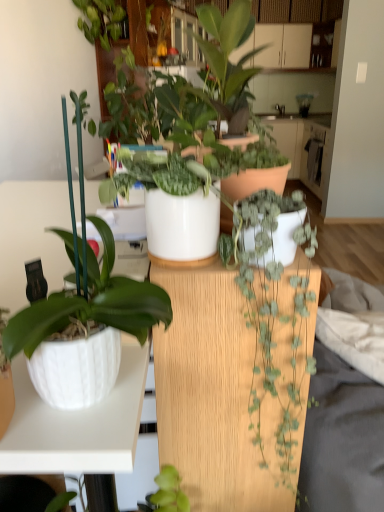
How much space does white glossy pot at left, the third houseplant when ordered from top to bottom, occupy vertically?

The height of white glossy pot at left, the third houseplant when ordered from top to bottom, is 45.43 centimeters.

What do you see at coordinates (301, 117) in the screenshot? The height and width of the screenshot is (512, 384). I see `white glossy countertop at center` at bounding box center [301, 117].

Measure the distance between point (x=316, y=119) and camera.

The depth of point (x=316, y=119) is 16.52 feet.

This screenshot has height=512, width=384. Find the location of `white glossy pot at left, the third houseplant when ordered from top to bottom`. white glossy pot at left, the third houseplant when ordered from top to bottom is located at coordinates (83, 313).

How different are the orientations of white glossy pot at center, the 2th houseplant when ordered from top to bottom, and matte white pot at center, acting as the 1th houseplant starting from the top, in degrees?

The facing directions of white glossy pot at center, the 2th houseplant when ordered from top to bottom, and matte white pot at center, acting as the 1th houseplant starting from the top, are 0.000222 degrees apart.

Looking at this image, is white glossy pot at center, the 2th houseplant when ordered from top to bottom, in front of or behind matte white pot at center, which appears as the fourth houseplant when ordered from the bottom, in the image?

Visually, white glossy pot at center, the 2th houseplant when ordered from top to bottom, is located in front of matte white pot at center, which appears as the fourth houseplant when ordered from the bottom.

Consider the image. From a real-world perspective, does white glossy pot at center, the 2th houseplant when ordered from top to bottom, sit lower than matte white pot at center, acting as the 1th houseplant starting from the top?

Yes, from a real-world perspective, white glossy pot at center, the 2th houseplant when ordered from top to bottom, is beneath matte white pot at center, acting as the 1th houseplant starting from the top.

From the picture: Is white glossy pot at center, placed as the third houseplant when sorted from bottom to top, far away from matte white pot at center, acting as the 1th houseplant starting from the top?

white glossy pot at center, placed as the third houseplant when sorted from bottom to top, is near matte white pot at center, acting as the 1th houseplant starting from the top, not far away.

Looking at their sizes, would you say white glossy pot at center, the 2th houseplant when ordered from top to bottom, is wider or thinner than white glossy pot at left, the second houseplant in the bottom-to-top sequence?

Clearly, white glossy pot at center, the 2th houseplant when ordered from top to bottom, has less width compared to white glossy pot at left, the second houseplant in the bottom-to-top sequence.

Considering the positions of objects white glossy pot at center, placed as the third houseplant when sorted from bottom to top, and white glossy pot at left, the second houseplant in the bottom-to-top sequence, in the image provided, who is more to the left, white glossy pot at center, placed as the third houseplant when sorted from bottom to top, or white glossy pot at left, the second houseplant in the bottom-to-top sequence,?

Positioned to the left is white glossy pot at left, the second houseplant in the bottom-to-top sequence.

Is white glossy pot at center, the 2th houseplant when ordered from top to bottom, not within white glossy pot at left, the second houseplant in the bottom-to-top sequence?

Yes.

Based on the photo, how many degrees apart are the facing directions of white glossy pot at center, the 2th houseplant when ordered from top to bottom, and white glossy pot at left, the third houseplant when ordered from top to bottom?

0.000158 degrees.

From a real-world perspective, is white glossy pot at left, the third houseplant when ordered from top to bottom, positioned over matte white pot at center, which appears as the fourth houseplant when ordered from the bottom, based on gravity?

No, from a real-world perspective, white glossy pot at left, the third houseplant when ordered from top to bottom, is not over matte white pot at center, which appears as the fourth houseplant when ordered from the bottom

Considering the sizes of objects white glossy pot at left, the third houseplant when ordered from top to bottom, and matte white pot at center, which appears as the fourth houseplant when ordered from the bottom, in the image provided, who is wider, white glossy pot at left, the third houseplant when ordered from top to bottom, or matte white pot at center, which appears as the fourth houseplant when ordered from the bottom,?

Wider between the two is matte white pot at center, which appears as the fourth houseplant when ordered from the bottom.

Between white glossy pot at left, the second houseplant in the bottom-to-top sequence, and matte white pot at center, which appears as the fourth houseplant when ordered from the bottom, which one has less height?

Standing shorter between the two is matte white pot at center, which appears as the fourth houseplant when ordered from the bottom.

Is white glossy pot at left, the second houseplant in the bottom-to-top sequence, positioned behind matte white pot at center, acting as the 1th houseplant starting from the top?

No, it is not.

Is white glossy countertop at center at the back of matte white pot at center, acting as the 1th houseplant starting from the top?

No, matte white pot at center, acting as the 1th houseplant starting from the top, is not facing the opposite direction of white glossy countertop at center.

From the image's perspective, which one is positioned lower, matte white pot at center, acting as the 1th houseplant starting from the top, or white glossy countertop at center?

matte white pot at center, acting as the 1th houseplant starting from the top, appears lower in the image.

From a real-world perspective, starting from the white glossy countertop at center, which houseplant is the 3rd one vertically above it? Please provide its 2D coordinates.

[(227, 63)]

Which object is positioned more to the left, white glossy pot at left, the third houseplant when ordered from top to bottom, or white glossy pot at center, placed as the third houseplant when sorted from bottom to top?

white glossy pot at left, the third houseplant when ordered from top to bottom, is more to the left.

Does point (73, 264) come in front of point (207, 106)?

Yes.

In the scene shown: Relative to white glossy pot at center, the 2th houseplant when ordered from top to bottom, is white glossy pot at left, the second houseplant in the bottom-to-top sequence, in front or behind?

In the image, white glossy pot at left, the second houseplant in the bottom-to-top sequence, appears in front of white glossy pot at center, the 2th houseplant when ordered from top to bottom.

Is white glossy pot at left, the second houseplant in the bottom-to-top sequence, oriented away from white glossy pot at center, placed as the third houseplant when sorted from bottom to top?

white glossy pot at left, the second houseplant in the bottom-to-top sequence, is not turned away from white glossy pot at center, placed as the third houseplant when sorted from bottom to top.

Can you see matte white pot at center, which appears as the fourth houseplant when ordered from the bottom, touching white glossy pot at left, the third houseplant when ordered from top to bottom?

No.

Looking at this image, how different are the orientations of matte white pot at center, which appears as the fourth houseplant when ordered from the bottom, and white glossy pot at left, the second houseplant in the bottom-to-top sequence, in degrees?

A: 6.52e-05 degrees separate the facing orientations of matte white pot at center, which appears as the fourth houseplant when ordered from the bottom, and white glossy pot at left, the second houseplant in the bottom-to-top sequence.

Which of these two, matte white pot at center, acting as the 1th houseplant starting from the top, or white glossy pot at left, the second houseplant in the bottom-to-top sequence, is bigger?

white glossy pot at left, the second houseplant in the bottom-to-top sequence, is bigger.

Which object is closer to the camera taking this photo, matte white pot at center, which appears as the fourth houseplant when ordered from the bottom, or white glossy pot at left, the third houseplant when ordered from top to bottom?

white glossy pot at left, the third houseplant when ordered from top to bottom, is in front.

Considering the relative positions of white glossy countertop at center and white glossy pot at center, the 2th houseplant when ordered from top to bottom, in the image provided, is white glossy countertop at center behind white glossy pot at center, the 2th houseplant when ordered from top to bottom,?

Yes, it is behind white glossy pot at center, the 2th houseplant when ordered from top to bottom.

From the image's perspective, is white glossy countertop at center below white glossy pot at center, placed as the third houseplant when sorted from bottom to top?

Actually, white glossy countertop at center appears above white glossy pot at center, placed as the third houseplant when sorted from bottom to top, in the image.

Between white glossy countertop at center and white glossy pot at center, placed as the third houseplant when sorted from bottom to top, which one has larger size?

With larger size is white glossy countertop at center.

Considering the relative positions of white glossy countertop at center and white glossy pot at center, the 2th houseplant when ordered from top to bottom, in the image provided, is white glossy countertop at center to the left or to the right of white glossy pot at center, the 2th houseplant when ordered from top to bottom,?

white glossy countertop at center is to the right of white glossy pot at center, the 2th houseplant when ordered from top to bottom.

Locate an element on the screen. houseplant above the white glossy pot at center, the 2th houseplant when ordered from top to bottom (from the image's perspective) is located at coordinates (227, 63).

From a real-world perspective, which houseplant is the 1st one underneath the white glossy pot at center, the 2th houseplant when ordered from top to bottom? Please provide its 2D coordinates.

[(83, 313)]

From the picture: From the image, which object appears to be farther from green matte plant at center, the fourth houseplant from the top, white glossy countertop at center or white glossy pot at center, placed as the third houseplant when sorted from bottom to top?

The object further to green matte plant at center, the fourth houseplant from the top, is white glossy countertop at center.

Considering their positions, is matte white pot at center, acting as the 1th houseplant starting from the top, positioned closer to white glossy countertop at center than green matte plant at center, the fourth houseplant from the top?

The object closer to white glossy countertop at center is matte white pot at center, acting as the 1th houseplant starting from the top.

When comparing their distances from white glossy pot at left, the third houseplant when ordered from top to bottom, does white glossy pot at center, the 2th houseplant when ordered from top to bottom, or matte white pot at center, which appears as the fourth houseplant when ordered from the bottom, seem further?

matte white pot at center, which appears as the fourth houseplant when ordered from the bottom, lies further to white glossy pot at left, the third houseplant when ordered from top to bottom, than the other object.

From the image, which object appears to be farther from white glossy pot at left, the third houseplant when ordered from top to bottom, white glossy pot at center, the 2th houseplant when ordered from top to bottom, or white glossy countertop at center?

The object further to white glossy pot at left, the third houseplant when ordered from top to bottom, is white glossy countertop at center.

Which object lies nearer to the anchor point white glossy pot at left, the second houseplant in the bottom-to-top sequence, green matte plant at center, the fourth houseplant from the top, or matte white pot at center, which appears as the fourth houseplant when ordered from the bottom?

green matte plant at center, the fourth houseplant from the top, is positioned closer to the anchor white glossy pot at left, the second houseplant in the bottom-to-top sequence.

Estimate the real-world distances between objects in this image. Which object is closer to matte white pot at center, which appears as the fourth houseplant when ordered from the bottom, white glossy pot at center, placed as the third houseplant when sorted from bottom to top, or green matte plant at center, arranged as the 1th houseplant when ordered from the bottom?

white glossy pot at center, placed as the third houseplant when sorted from bottom to top.

Which object lies nearer to the anchor point white glossy pot at center, placed as the third houseplant when sorted from bottom to top, white glossy countertop at center or white glossy pot at left, the third houseplant when ordered from top to bottom?

white glossy pot at left, the third houseplant when ordered from top to bottom, is positioned closer to the anchor white glossy pot at center, placed as the third houseplant when sorted from bottom to top.

Looking at the image, which one is located further to white glossy countertop at center, white glossy pot at center, the 2th houseplant when ordered from top to bottom, or matte white pot at center, acting as the 1th houseplant starting from the top?

white glossy pot at center, the 2th houseplant when ordered from top to bottom, lies further to white glossy countertop at center than the other object.

Locate an element on the screen. The height and width of the screenshot is (512, 384). houseplant that lies between white glossy pot at center, the 2th houseplant when ordered from top to bottom, and green matte plant at center, the fourth houseplant from the top, from top to bottom is located at coordinates (83, 313).

You are a GUI agent. You are given a task and a screenshot of the screen. Output one action in this format:
    pyautogui.click(x=<x>, y=<y>)
    Task: Click on the houseplant positioned between green matte plant at center, the fourth houseplant from the top, and white glossy countertop at center from near to far
    The image size is (384, 512).
    Given the screenshot: What is the action you would take?
    pyautogui.click(x=227, y=63)